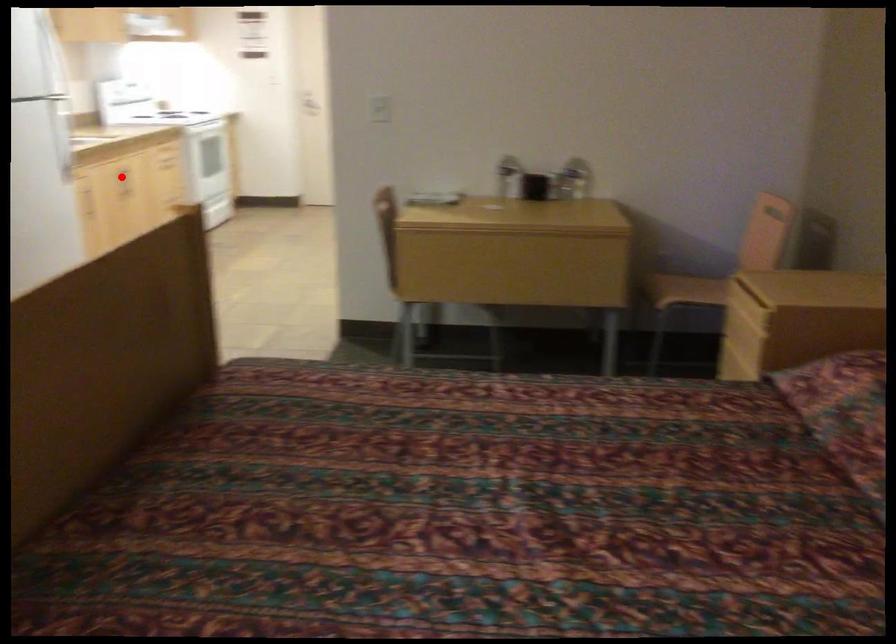
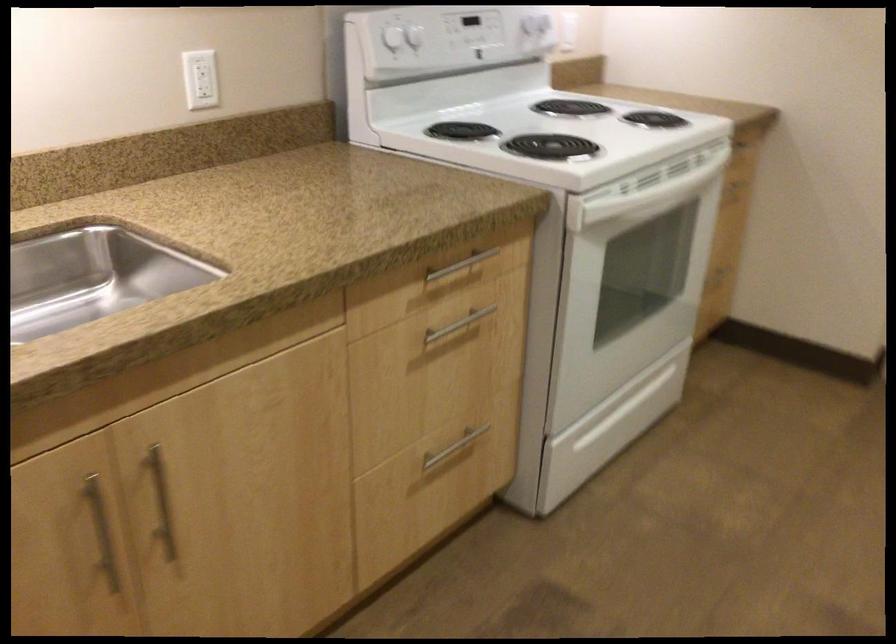
Question: I am providing you with two images of the same scene from different viewpoints. A red point is shown in image1. For the corresponding object point in image2, is it positioned nearer or farther from the camera?

Choices:
 (A) Nearer
 (B) Farther

Answer: (A)